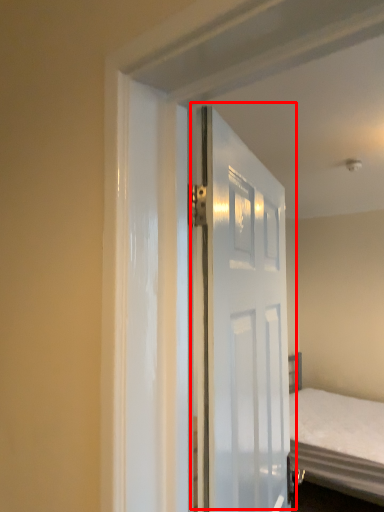
Question: From the image's perspective, where is door (annotated by the red box) located in relation to bed in the image?

Choices:
 (A) above
 (B) below

Answer: (A)